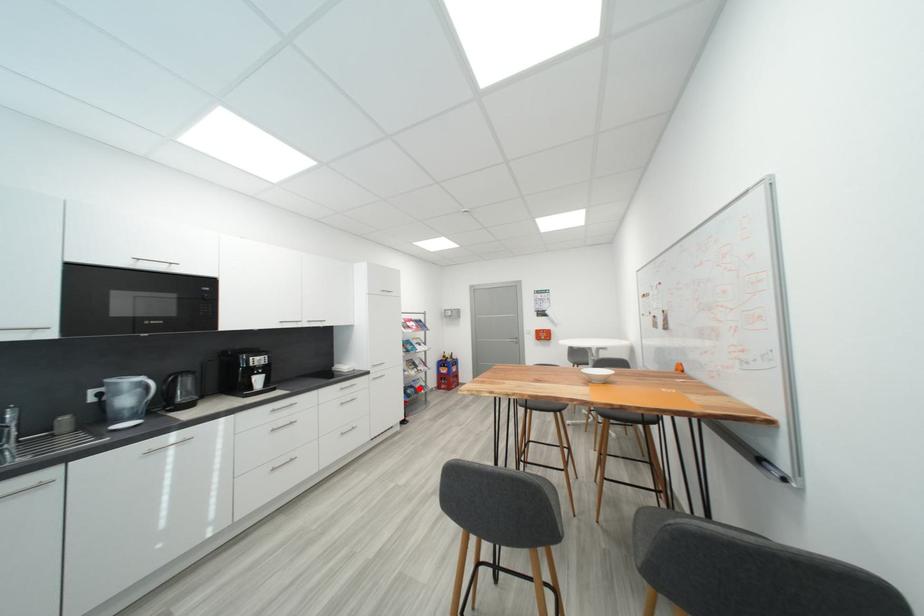
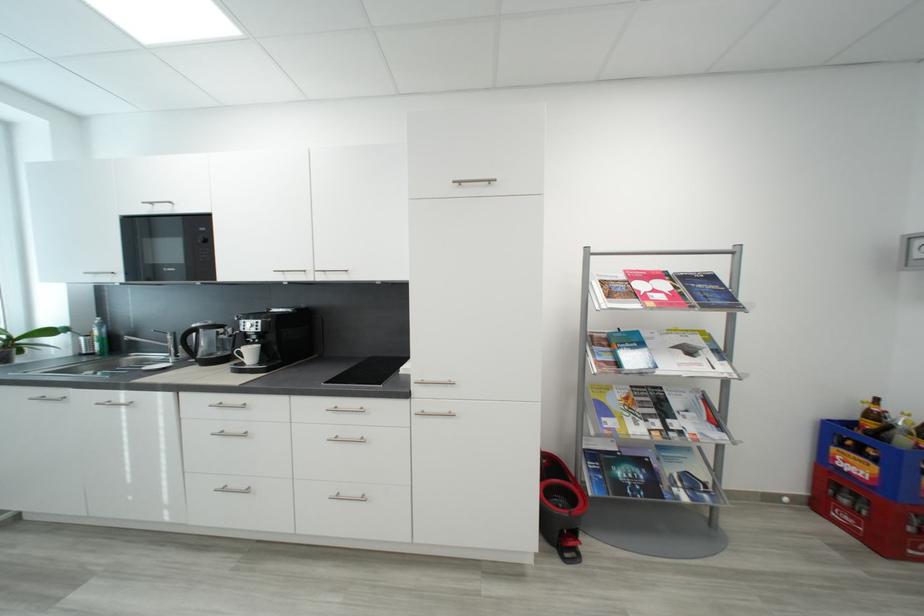
Question: I am providing you with two images of the same scene from different viewpoints. Image1 has a red point marked. In image2, the corresponding 3D location appears at what relative position? Reply with the corresponding letter.

Choices:
 (A) Closer
 (B) Farther

Answer: (A)